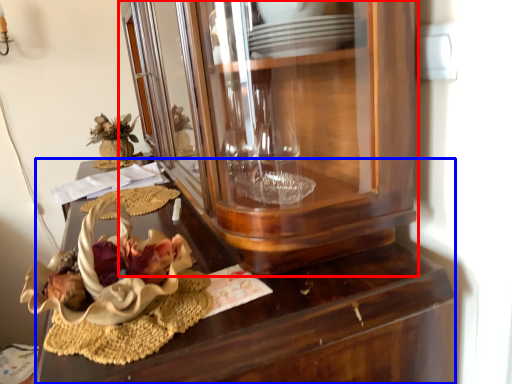
Question: Which object appears farthest to the camera in this image, cabinetry (highlighted by a red box) or desk (highlighted by a blue box)?

Choices:
 (A) cabinetry
 (B) desk

Answer: (B)